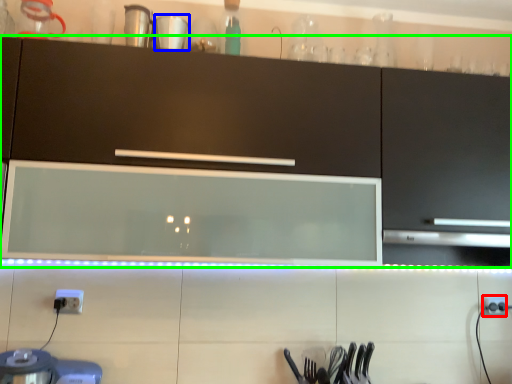
Question: Estimate the real-world distances between objects in this image. Which object is closer to electric outlet (highlighted by a red box), tableware (highlighted by a blue box) or cabinetry (highlighted by a green box)?

Choices:
 (A) tableware
 (B) cabinetry

Answer: (B)